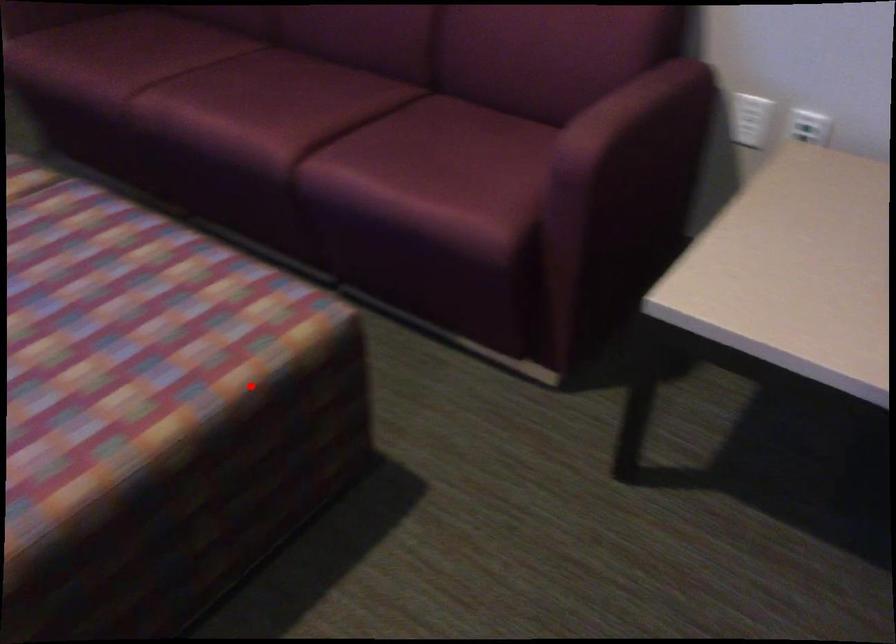
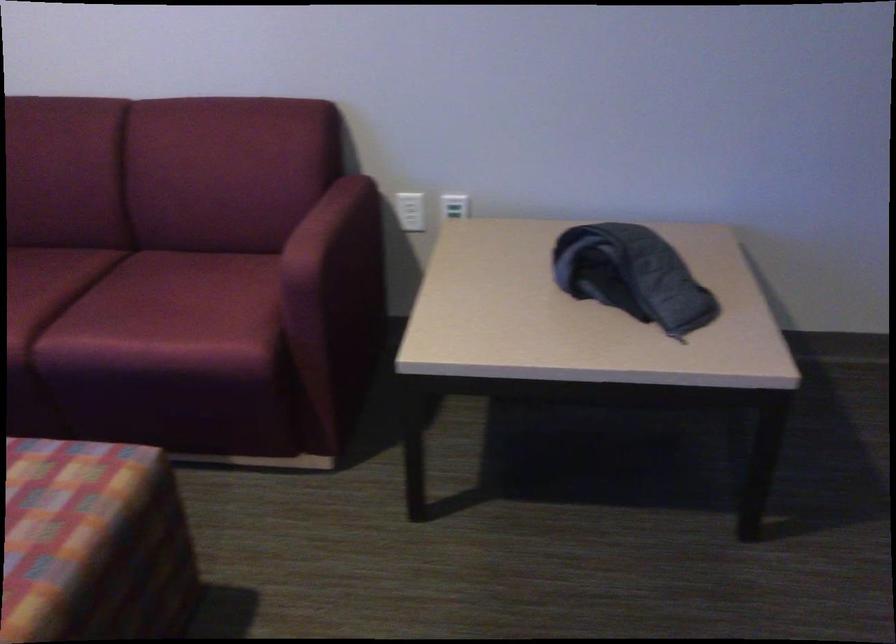
The point at the highlighted location is marked in the first image. Where is the corresponding point in the second image?

(93, 544)